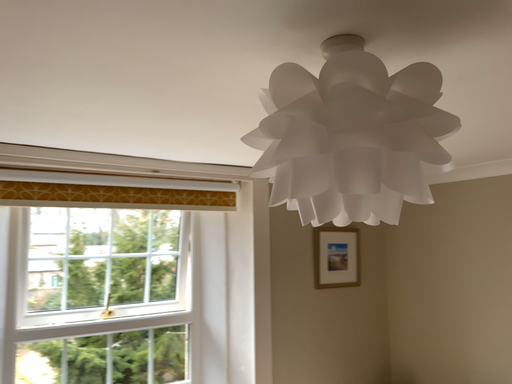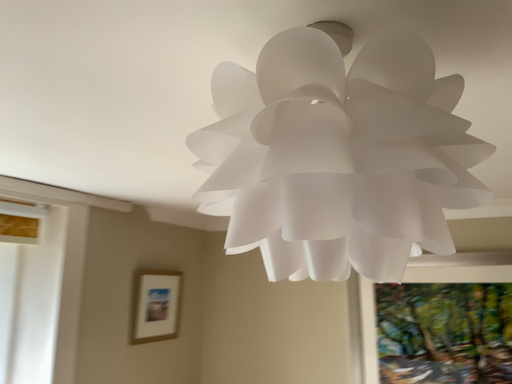
Question: How did the camera likely rotate when shooting the video?

Choices:
 (A) rotated right
 (B) rotated left

Answer: (A)